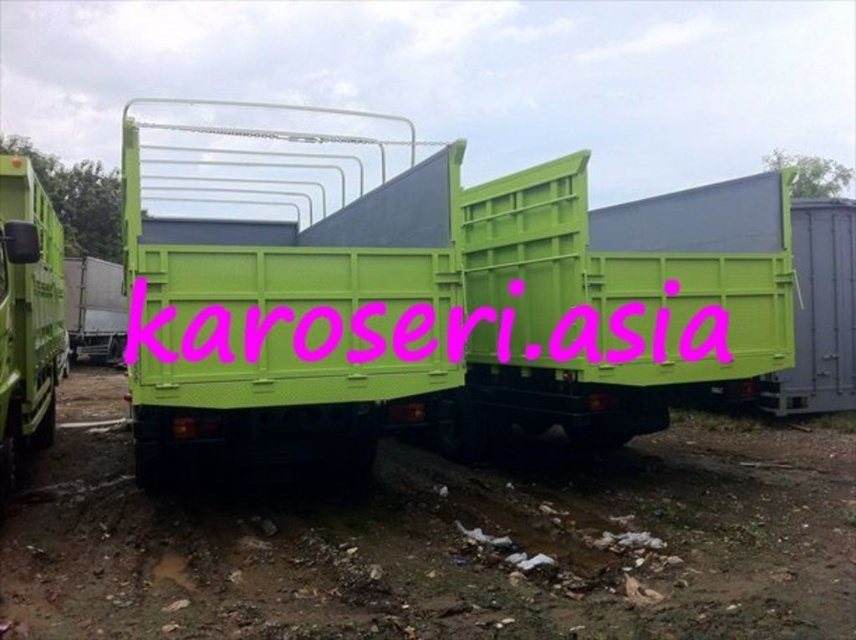
Question: Which object appears farthest from the camera in this image?

Choices:
 (A) green matte truck at center
 (B) matte green truck at left

Answer: (B)

Question: Can you confirm if green matte truck at center is positioned to the right of matte green truck at left?

Choices:
 (A) yes
 (B) no

Answer: (A)

Question: Where is green matte truck at center located in relation to matte green truck at left in the image?

Choices:
 (A) left
 (B) right

Answer: (B)

Question: Does green matte truck at center lie behind matte green truck at left?

Choices:
 (A) yes
 (B) no

Answer: (B)

Question: Among these objects, which one is nearest to the camera?

Choices:
 (A) green matte truck at center
 (B) matte green truck at left

Answer: (A)